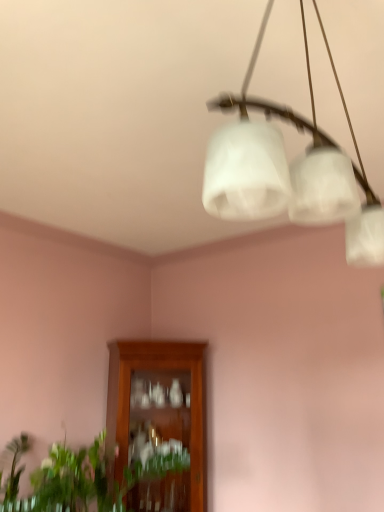
Question: Are white frosted glass chandelier at upper center and green leafy plant at lower left beside each other?

Choices:
 (A) yes
 (B) no

Answer: (B)

Question: Considering the relative sizes of white frosted glass chandelier at upper center and green leafy plant at lower left in the image provided, is white frosted glass chandelier at upper center shorter than green leafy plant at lower left?

Choices:
 (A) yes
 (B) no

Answer: (B)

Question: Is the position of white frosted glass chandelier at upper center more distant than that of green leafy plant at lower left?

Choices:
 (A) yes
 (B) no

Answer: (B)

Question: From the image's perspective, is white frosted glass chandelier at upper center located above green leafy plant at lower left?

Choices:
 (A) no
 (B) yes

Answer: (B)

Question: Can you confirm if white frosted glass chandelier at upper center is thinner than green leafy plant at lower left?

Choices:
 (A) no
 (B) yes

Answer: (B)

Question: From a real-world perspective, is white frosted glass chandelier at upper center on green leafy plant at lower left?

Choices:
 (A) yes
 (B) no

Answer: (A)

Question: Is green leafy plant at lower left thinner than wooden cabinet at center?

Choices:
 (A) no
 (B) yes

Answer: (A)

Question: Considering the relative sizes of green leafy plant at lower left and wooden cabinet at center in the image provided, is green leafy plant at lower left smaller than wooden cabinet at center?

Choices:
 (A) yes
 (B) no

Answer: (A)

Question: From the image's perspective, does green leafy plant at lower left appear higher than wooden cabinet at center?

Choices:
 (A) no
 (B) yes

Answer: (B)

Question: Is green leafy plant at lower left wider than wooden cabinet at center?

Choices:
 (A) no
 (B) yes

Answer: (B)

Question: Would you say green leafy plant at lower left contains wooden cabinet at center?

Choices:
 (A) yes
 (B) no

Answer: (B)

Question: Is green leafy plant at lower left located outside wooden cabinet at center?

Choices:
 (A) no
 (B) yes

Answer: (B)

Question: Is green leafy plant at lower left in front of white frosted glass chandelier at upper center?

Choices:
 (A) yes
 (B) no

Answer: (B)